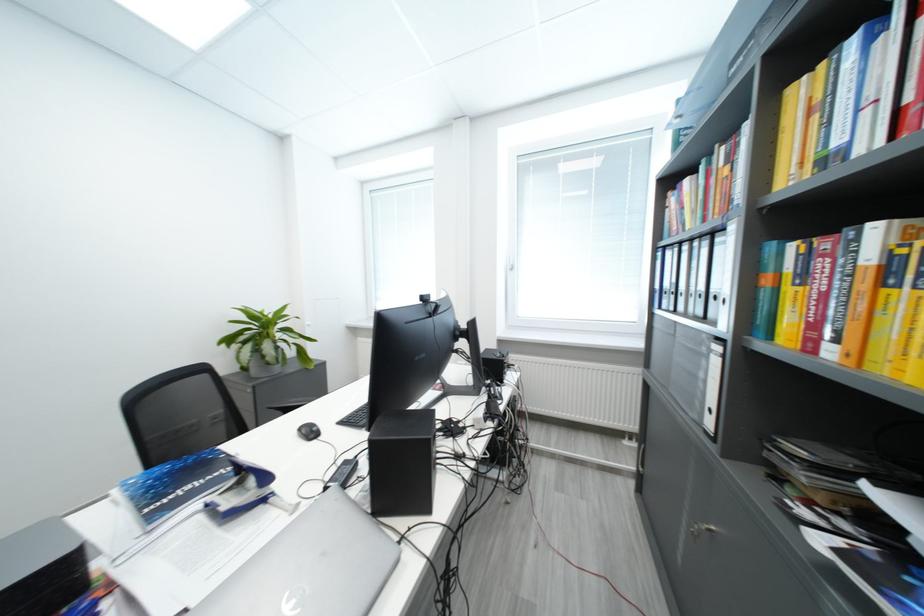
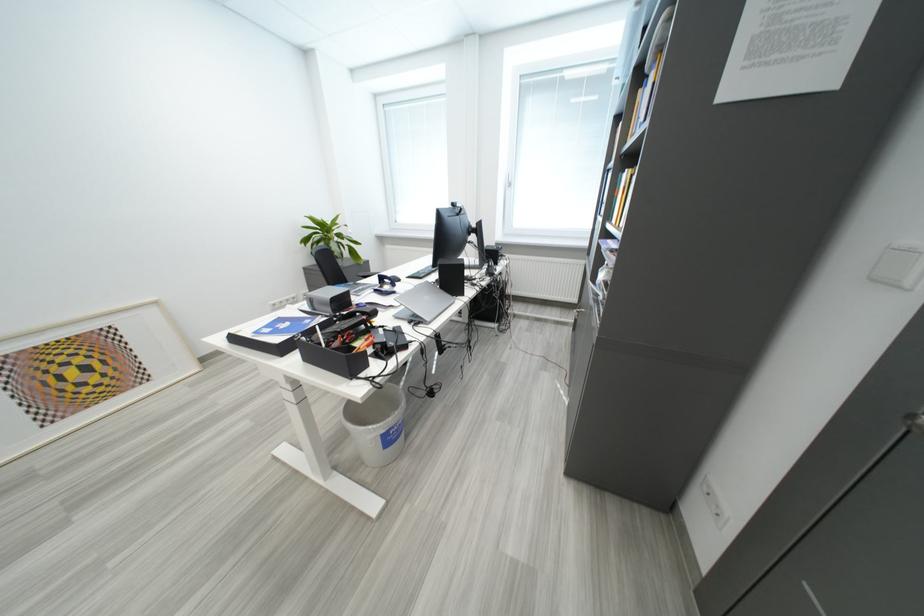
Find the pixel in the second image that matches point (222, 500) in the first image.

(384, 291)